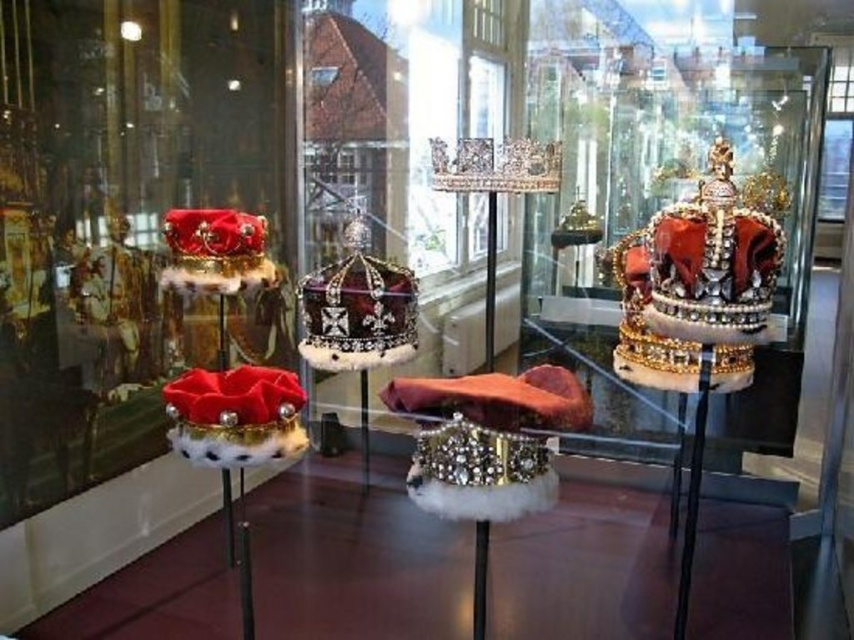
You are a museum curator planning to stack the shiny gold crown at right and the satin black crown at center vertically. Which crown should be placed at the bottom to ensure stability?

The shiny gold crown at right is taller than the satin black crown at center, so placing the taller shiny gold crown at right at the bottom would provide a more stable base for the stack.

You are standing in front of the museum exhibit and want to take a photo of the crown at point (630,237). If your camera has a focal length of 50mm and you want to capture the entire crown in the frame, which is 0.5 meters wide, what is the minimum distance you should maintain from the crown to ensure it fits within the camera sensor?

The minimum distance to maintain is 2.20 meters because the camera is already positioned 2.20 meters away from the crown at point (630,237), which ensures the crown fits within the frame given its width and the camera specifications.

You are a visitor standing in front of the glass case displaying the shiny gold crown at right. The museum requires you to maintain a minimum distance of 1.5 meters from the exhibit for safety. Are you compliant with this rule?

The distance between you and the shiny gold crown at right is 1.60 meters, which is greater than the required 1.5 meters. Therefore, you are compliant with the museum safety rule.